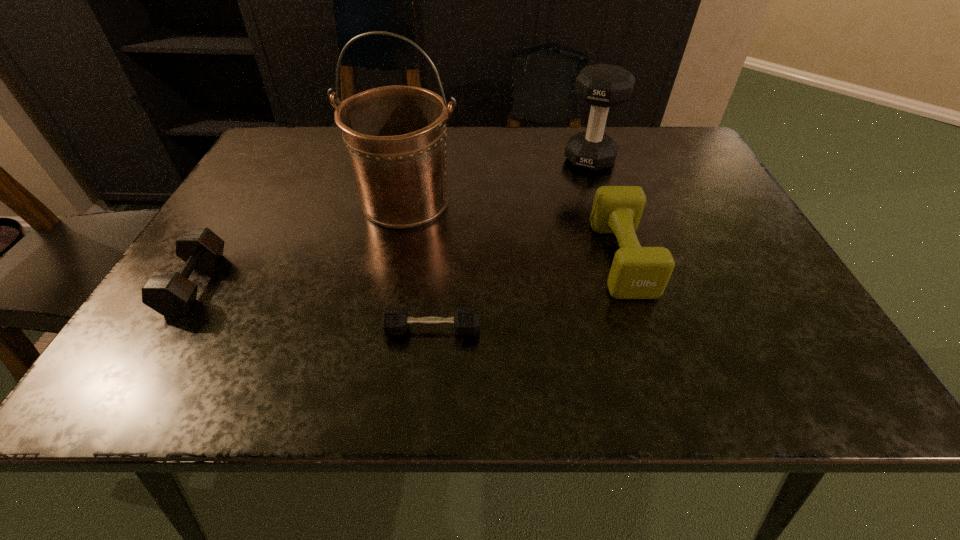
At what (x,y) coordinates should I click in order to perform the action: click on bucket. Please return your answer as a coordinate pair (x, y). This screenshot has width=960, height=540. Looking at the image, I should click on (395, 135).

What are the coordinates of `the farthest dumbbell` in the screenshot? It's located at (602, 86).

Find the location of a particular element. The width and height of the screenshot is (960, 540). the second tallest object is located at coordinates (602, 86).

The width and height of the screenshot is (960, 540). I want to click on the third shortest dumbbell, so click(x=637, y=272).

The image size is (960, 540). I want to click on the second shortest dumbbell, so click(x=169, y=293).

You are a GUI agent. You are given a task and a screenshot of the screen. Output one action in this format:
    pyautogui.click(x=<x>, y=<y>)
    Task: Click on the leftmost object
    The width and height of the screenshot is (960, 540).
    Given the screenshot: What is the action you would take?
    pyautogui.click(x=169, y=293)

Locate an element on the screen. the nearest dumbbell is located at coordinates (394, 321).

Where is `the shortest dumbbell`? the shortest dumbbell is located at coordinates (394, 321).

In order to click on blank space located 0.200m on the right of the tallest object in this screenshot , I will do `click(546, 201)`.

Where is `vacant region located 0.200m on the front of the farthest dumbbell`? vacant region located 0.200m on the front of the farthest dumbbell is located at coordinates (611, 225).